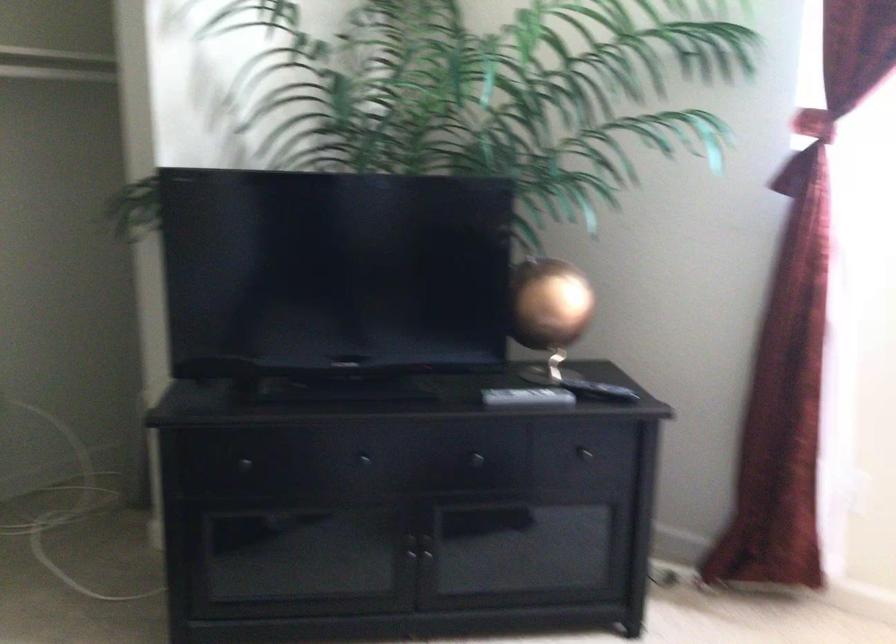
Which object does [527,397] point to?

It corresponds to the white remote control in the image.